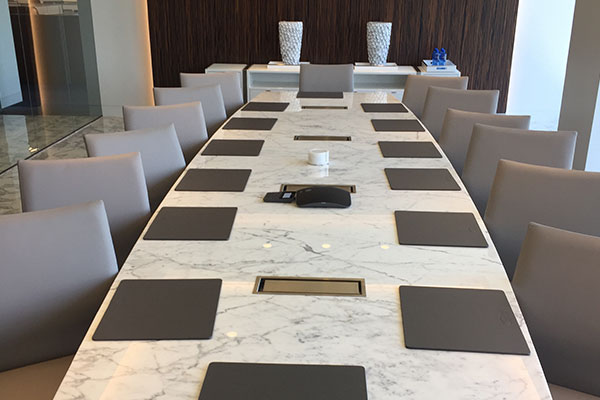
Identify the location of glass wall. The image size is (600, 400). (47, 69).